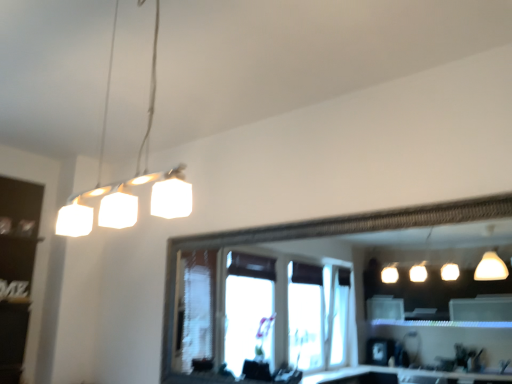
Describe the element at coordinates (128, 180) in the screenshot. The image size is (512, 384). I see `white matte cube at upper left` at that location.

Where is `white matte cube at upper left`? The height and width of the screenshot is (384, 512). white matte cube at upper left is located at coordinates (128, 180).

The height and width of the screenshot is (384, 512). Describe the element at coordinates (16, 269) in the screenshot. I see `black matte shelf at left` at that location.

This screenshot has width=512, height=384. Find the location of `black matte shelf at left`. black matte shelf at left is located at coordinates (16, 269).

You are a GUI agent. You are given a task and a screenshot of the screen. Output one action in this format:
    pyautogui.click(x=<x>, y=<y>)
    Task: Click on the white matte cube at upper left
    
    Given the screenshot: What is the action you would take?
    pyautogui.click(x=128, y=180)

Considering the positions of objects white matte cube at upper left and black matte shelf at left in the image provided, who is more to the left, white matte cube at upper left or black matte shelf at left?

black matte shelf at left.

Which is in front, white matte cube at upper left or black matte shelf at left?

Positioned in front is white matte cube at upper left.

Considering the positions of point (57, 217) and point (9, 342), is point (57, 217) closer or farther from the camera than point (9, 342)?

Point (57, 217).

From the image's perspective, which is below, white matte cube at upper left or black matte shelf at left?

black matte shelf at left appears lower in the image.

From a real-world perspective, who is located higher, white matte cube at upper left or black matte shelf at left?

In real-world perspective, white matte cube at upper left is above.

Considering the relative sizes of white matte cube at upper left and black matte shelf at left in the image provided, is white matte cube at upper left thinner than black matte shelf at left?

Correct, the width of white matte cube at upper left is less than that of black matte shelf at left.

Considering the sizes of objects white matte cube at upper left and black matte shelf at left in the image provided, who is taller, white matte cube at upper left or black matte shelf at left?

Standing taller between the two is black matte shelf at left.

Who is bigger, white matte cube at upper left or black matte shelf at left?

black matte shelf at left is bigger.

Is white matte cube at upper left located outside black matte shelf at left?

Yes.

Does white matte cube at upper left touch black matte shelf at left?

No, white matte cube at upper left is not making contact with black matte shelf at left.

Is white matte cube at upper left facing towards black matte shelf at left?

No, white matte cube at upper left is not turned towards black matte shelf at left.

What's the angular difference between white matte cube at upper left and black matte shelf at left's facing directions?

90 degrees separate the facing orientations of white matte cube at upper left and black matte shelf at left.

How far apart are white matte cube at upper left and black matte shelf at left?

white matte cube at upper left and black matte shelf at left are 20.23 inches apart.

At what (x,y) coordinates should I click in order to perform the action: click on shelf behind the white matte cube at upper left. Please return your answer as a coordinate pair (x, y). Looking at the image, I should click on (16, 269).

Is black matte shelf at left at the right side of white matte cube at upper left?

No.

Which object is closer to the camera, black matte shelf at left or white matte cube at upper left?

white matte cube at upper left is more forward.

Between point (32, 217) and point (158, 6), which one is positioned behind?

Positioned behind is point (32, 217).

From the image's perspective, who appears lower, black matte shelf at left or white matte cube at upper left?

black matte shelf at left is shown below in the image.

Based on the photo, from a real-world perspective, between black matte shelf at left and white matte cube at upper left, who is vertically lower?

black matte shelf at left.

Considering the sizes of objects black matte shelf at left and white matte cube at upper left in the image provided, who is thinner, black matte shelf at left or white matte cube at upper left?

white matte cube at upper left.

Which of these two, black matte shelf at left or white matte cube at upper left, stands taller?

With more height is black matte shelf at left.

Is black matte shelf at left bigger or smaller than white matte cube at upper left?

Considering their sizes, black matte shelf at left takes up more space than white matte cube at upper left.

Choose the correct answer: Is black matte shelf at left inside white matte cube at upper left or outside it?

black matte shelf at left is not inside white matte cube at upper left, it's outside.

Does black matte shelf at left touch white matte cube at upper left?

No, black matte shelf at left is not making contact with white matte cube at upper left.

Is black matte shelf at left turned away from white matte cube at upper left?

No, white matte cube at upper left is not at the back of black matte shelf at left.

This screenshot has width=512, height=384. There is a black matte shelf at left. In order to click on lamp above it (from a real-world perspective) in this screenshot , I will do `click(128, 180)`.

Image resolution: width=512 pixels, height=384 pixels. Find the location of `lamp located in front of the black matte shelf at left`. lamp located in front of the black matte shelf at left is located at coordinates (128, 180).

Identify the location of shelf behind the white matte cube at upper left. (16, 269).